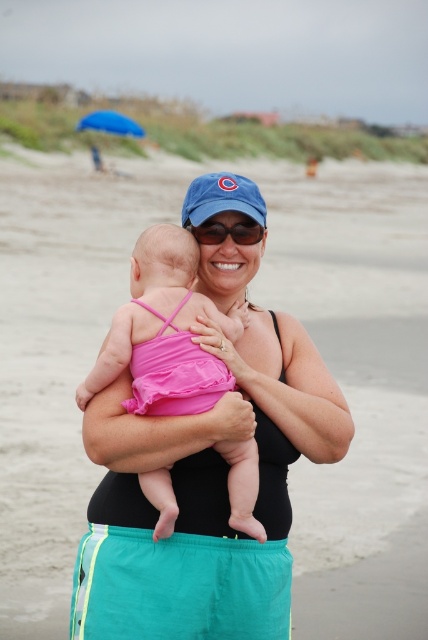
Who is shorter, black matte arm at center or blue fabric umbrella at upper left?

black matte arm at center is shorter.

Between black matte arm at center and blue fabric umbrella at upper left, which one appears on the left side from the viewer's perspective?

Positioned to the left is blue fabric umbrella at upper left.

Is point (269, 320) in front of point (101, 124)?

Yes.

The width and height of the screenshot is (428, 640). Find the location of `black matte arm at center`. black matte arm at center is located at coordinates (288, 385).

Does point (187, 376) come farther from viewer compared to point (214, 224)?

No, (187, 376) is closer to viewer.

Is point (256, 456) closer to camera compared to point (247, 225)?

Yes, point (256, 456) is in front of point (247, 225).

Which is behind, point (158, 492) or point (226, 228)?

Point (226, 228)

Find the location of a particular element. Image resolution: width=428 pixels, height=640 pixels. pink fabric baby at center is located at coordinates (163, 332).

Looking at this image, between pink fabric baby at center and black matte arm at center, which one has less height?

black matte arm at center is shorter.

Which is in front, point (155, 301) or point (208, 337)?

Point (208, 337)

You are a GUI agent. You are given a task and a screenshot of the screen. Output one action in this format:
    pyautogui.click(x=<x>, y=<y>)
    Task: Click on the pink fabric baby at center
    This screenshot has height=640, width=428.
    Given the screenshot: What is the action you would take?
    pyautogui.click(x=163, y=332)